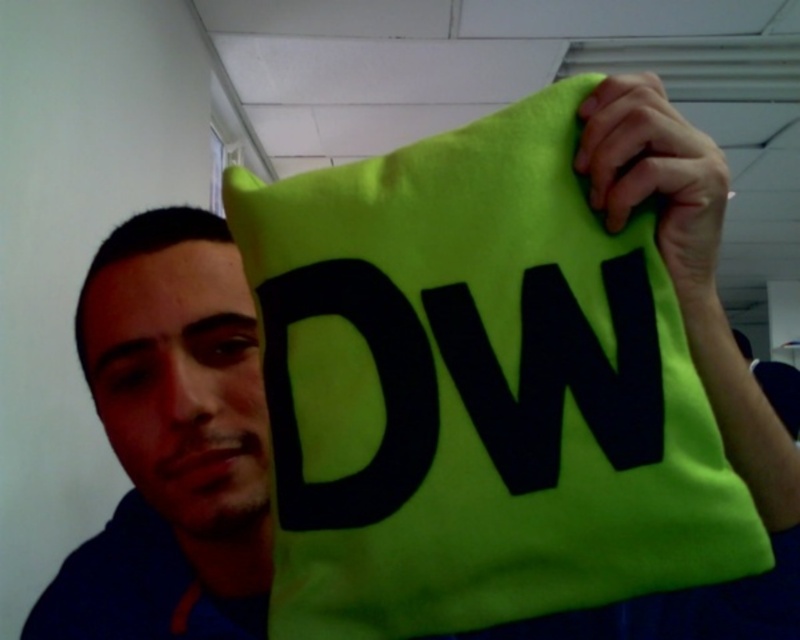
Question: Can you confirm if neon green fabric pillow at upper right is positioned above matte blue shirt at left?

Choices:
 (A) yes
 (B) no

Answer: (A)

Question: Which of the following is the closest to the observer?

Choices:
 (A) (596, 292)
 (B) (200, 378)

Answer: (A)

Question: Which object is farther from the camera taking this photo?

Choices:
 (A) matte blue shirt at left
 (B) neon green fabric pillow at upper right

Answer: (A)

Question: Is neon green fabric pillow at upper right bigger than matte blue shirt at left?

Choices:
 (A) yes
 (B) no

Answer: (B)

Question: Does neon green fabric pillow at upper right have a lesser width compared to matte blue shirt at left?

Choices:
 (A) no
 (B) yes

Answer: (A)

Question: Among these objects, which one is farthest from the camera?

Choices:
 (A) neon green fabric pillow at upper right
 (B) matte blue shirt at left

Answer: (B)